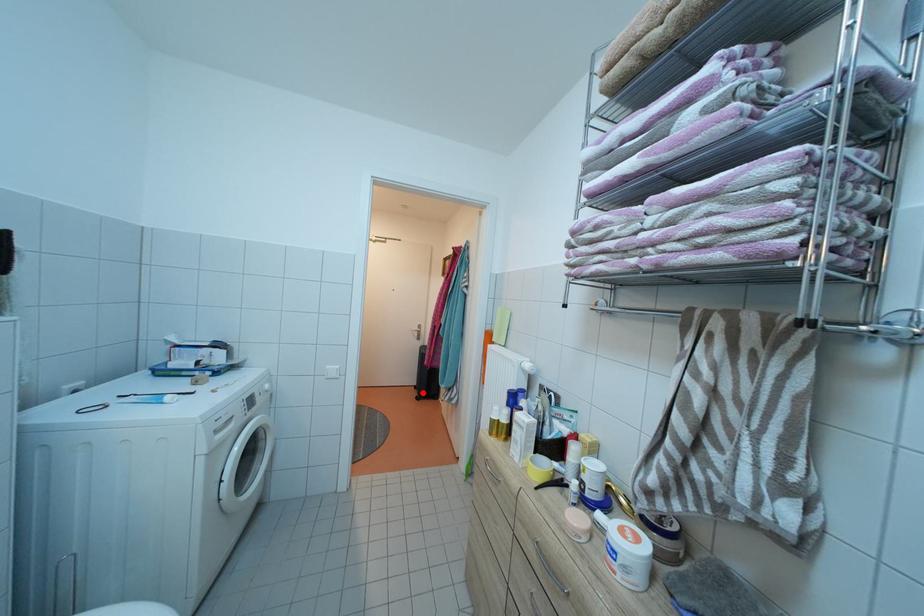
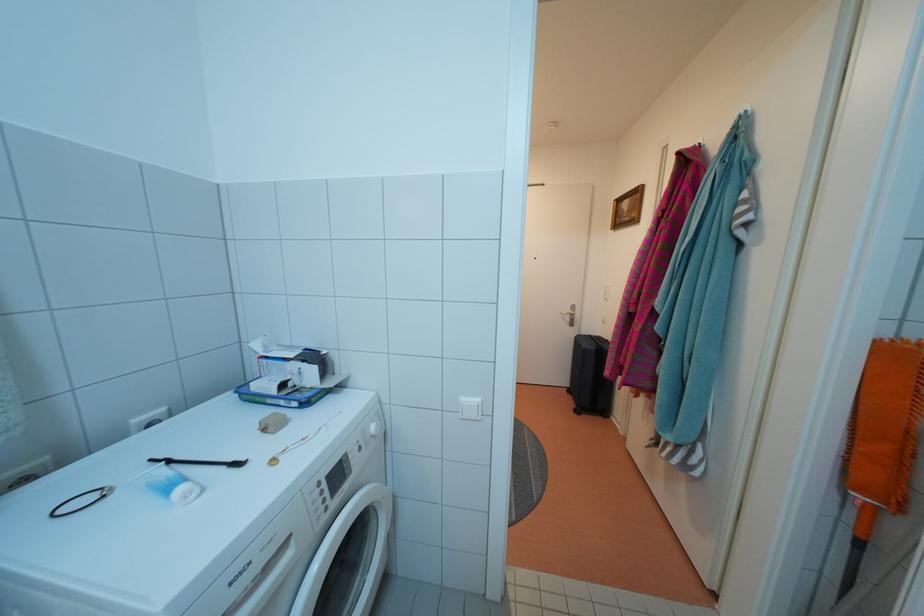
Where in the second image is the point corresponding to the highlighted location from the first image?

(576, 397)